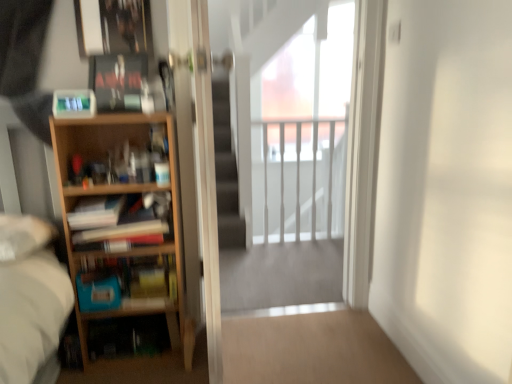
Question: From the image's perspective, would you say light wood bookcase at left is shown under white glossy railing at upper center?

Choices:
 (A) yes
 (B) no

Answer: (A)

Question: Is light wood bookcase at left wider than white glossy railing at upper center?

Choices:
 (A) no
 (B) yes

Answer: (B)

Question: Is light wood bookcase at left further to the viewer compared to white glossy railing at upper center?

Choices:
 (A) no
 (B) yes

Answer: (A)

Question: Does light wood bookcase at left lie in front of white glossy railing at upper center?

Choices:
 (A) yes
 (B) no

Answer: (A)

Question: From a real-world perspective, is light wood bookcase at left positioned over white glossy railing at upper center based on gravity?

Choices:
 (A) no
 (B) yes

Answer: (A)

Question: Is matte black book at upper left inside or outside of transparent glass screen door at center, the 1th screen door when ordered from left to right?

Choices:
 (A) inside
 (B) outside

Answer: (B)

Question: In terms of width, does matte black book at upper left look wider or thinner when compared to transparent glass screen door at center, the 2th screen door positioned from the right?

Choices:
 (A) wide
 (B) thin

Answer: (B)

Question: In the image, is matte black book at upper left positioned in front of or behind transparent glass screen door at center, the 1th screen door when ordered from left to right?

Choices:
 (A) behind
 (B) front

Answer: (A)

Question: From the image's perspective, is matte black book at upper left located above or below transparent glass screen door at center, the 1th screen door when ordered from left to right?

Choices:
 (A) below
 (B) above

Answer: (B)

Question: Is wooden bookshelf at left, which appears as the 1th book when ordered from the bottom, situated inside transparent glass screen door at center, the 2th screen door positioned from the right, or outside?

Choices:
 (A) outside
 (B) inside

Answer: (A)

Question: In terms of height, does wooden bookshelf at left, which is counted as the 3th book, starting from the top, look taller or shorter compared to transparent glass screen door at center, the 1th screen door when ordered from left to right?

Choices:
 (A) tall
 (B) short

Answer: (B)

Question: From the image's perspective, relative to transparent glass screen door at center, the 2th screen door positioned from the right, is wooden bookshelf at left, which appears as the 1th book when ordered from the bottom, above or below?

Choices:
 (A) below
 (B) above

Answer: (A)

Question: From a real-world perspective, is wooden bookshelf at left, which appears as the 1th book when ordered from the bottom, above or below transparent glass screen door at center, the 1th screen door when ordered from left to right?

Choices:
 (A) above
 (B) below

Answer: (B)

Question: Visually, is light wood bookcase at left positioned to the left or to the right of transparent glass screen door at center, the 1th screen door when ordered from left to right?

Choices:
 (A) right
 (B) left

Answer: (B)

Question: From a real-world perspective, is light wood bookcase at left positioned above or below transparent glass screen door at center, the 1th screen door when ordered from left to right?

Choices:
 (A) below
 (B) above

Answer: (A)